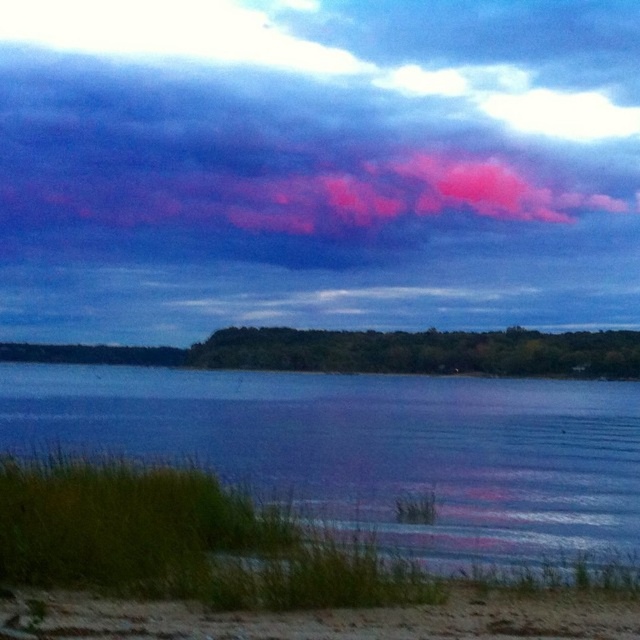
You are standing at the edge of the lakeside and want to find a spot to place your camping chair. You see the blue water at lower left and the sandy at lower left. Which one is closer to the right side of the lakeside?

The blue water at lower left is closer to the right side of the lakeside because it is positioned to the right of the sandy at lower left.

You are standing at the lakeside and see two points in the image. The first point is at coordinates point (36,432), and the second is at point (592,593). Which point is closer to you?

Point (36,432) is closer to you because it is further to the viewer than point (592,593).

You are standing at the center of the image and want to reach the blue water at lower left. Which direction should you move to get there?

You should move to the lower left direction to reach the blue water at lower left, as it is located at point (369,448) which is in the lower left quadrant of the image.